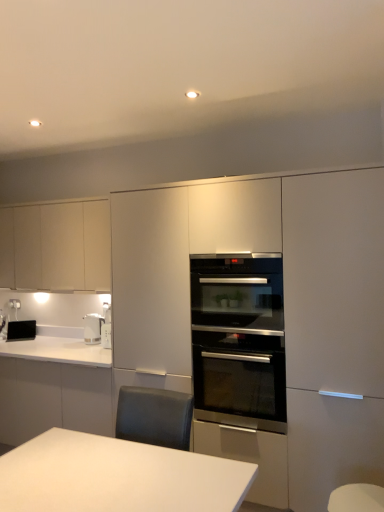
Question: Which direction should I rotate to face matte white oven at center, the first cabinetry when ordered from right to left, — up or down?

Choices:
 (A) down
 (B) up

Answer: (A)

Question: Does white glossy electric kettle at left come in front of matte white oven at center, which is the 2th cabinetry from back to front?

Choices:
 (A) no
 (B) yes

Answer: (A)

Question: Is white glossy electric kettle at left positioned beyond the bounds of matte white oven at center, the first cabinetry viewed from the front?

Choices:
 (A) yes
 (B) no

Answer: (A)

Question: Does white glossy electric kettle at left appear on the left side of matte white oven at center, the first cabinetry when ordered from right to left?

Choices:
 (A) yes
 (B) no

Answer: (A)

Question: Is the surface of white glossy electric kettle at left in direct contact with matte white oven at center, which is the 2th cabinetry from back to front?

Choices:
 (A) no
 (B) yes

Answer: (A)

Question: From the image's perspective, is white glossy electric kettle at left above matte white oven at center, the first cabinetry when ordered from right to left?

Choices:
 (A) yes
 (B) no

Answer: (B)

Question: From a real-world perspective, is white glossy electric kettle at left under matte white oven at center, which is counted as the 2th cabinetry, starting from the left?

Choices:
 (A) no
 (B) yes

Answer: (B)

Question: Is stainless steel oven at center outside black glossy toaster at lower left?

Choices:
 (A) yes
 (B) no

Answer: (A)

Question: Can you confirm if stainless steel oven at center is shorter than black glossy toaster at lower left?

Choices:
 (A) no
 (B) yes

Answer: (A)

Question: Is stainless steel oven at center positioned with its back to black glossy toaster at lower left?

Choices:
 (A) yes
 (B) no

Answer: (B)

Question: Does stainless steel oven at center have a lesser width compared to black glossy toaster at lower left?

Choices:
 (A) no
 (B) yes

Answer: (A)

Question: Is stainless steel oven at center taller than black glossy toaster at lower left?

Choices:
 (A) no
 (B) yes

Answer: (B)

Question: Considering the relative sizes of stainless steel oven at center and black glossy toaster at lower left in the image provided, is stainless steel oven at center smaller than black glossy toaster at lower left?

Choices:
 (A) no
 (B) yes

Answer: (A)

Question: Can you confirm if stainless steel oven at center is bigger than white glossy countertop at lower left?

Choices:
 (A) no
 (B) yes

Answer: (A)